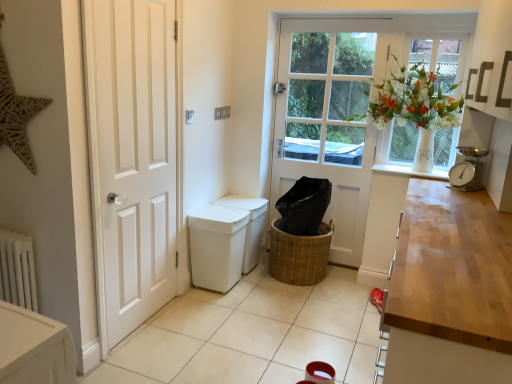
Image resolution: width=512 pixels, height=384 pixels. I want to click on vacant area that is in front of white plastic bin at lower center, so click(x=213, y=309).